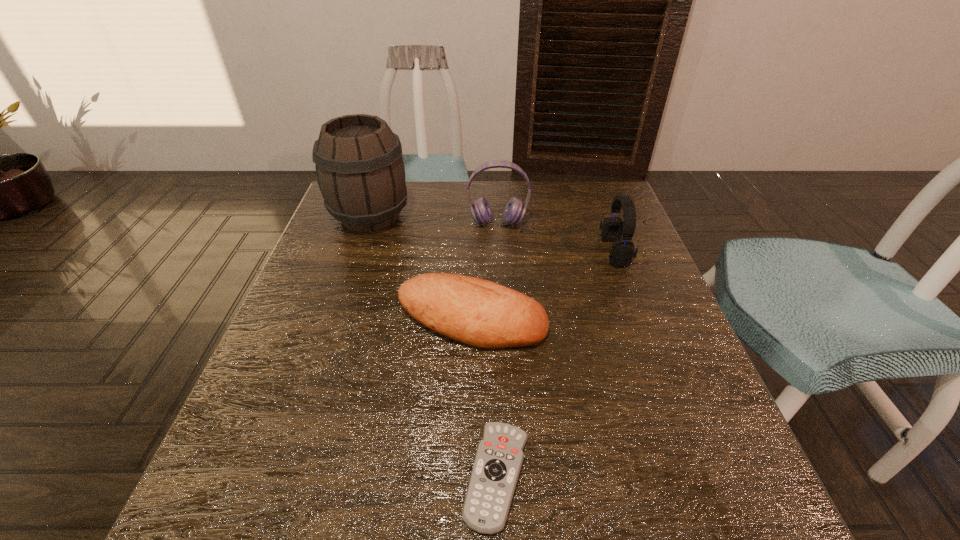
Where is `free space between the second shortest object and the third shortest object`? Image resolution: width=960 pixels, height=540 pixels. free space between the second shortest object and the third shortest object is located at coordinates (543, 286).

I want to click on free point between the second tallest object and the shortest object, so pos(497,349).

The width and height of the screenshot is (960, 540). Find the location of `vacant point located between the wine bucket and the remote control`. vacant point located between the wine bucket and the remote control is located at coordinates (434, 346).

Find the location of a particular element. empty space between the taller headset and the shortest object is located at coordinates (497, 349).

This screenshot has height=540, width=960. I want to click on free space between the leftmost object and the left headset, so click(434, 220).

The image size is (960, 540). I want to click on vacant point located between the nearer headset and the second shortest object, so click(543, 286).

Where is `free space between the right headset and the bread`? free space between the right headset and the bread is located at coordinates (543, 286).

Image resolution: width=960 pixels, height=540 pixels. What are the coordinates of `empty space that is in between the remote control and the farther headset` in the screenshot? It's located at (497, 349).

Where is `unoccupied area between the leftmost object and the second nearest object`? This screenshot has width=960, height=540. unoccupied area between the leftmost object and the second nearest object is located at coordinates tap(421, 268).

Locate an element on the screen. This screenshot has height=540, width=960. unoccupied area between the shorter headset and the second nearest object is located at coordinates (543, 286).